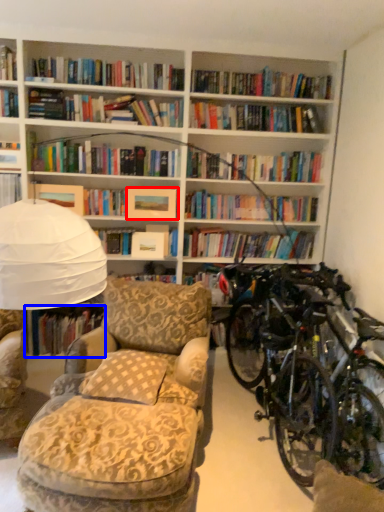
Question: Which of the following is the farthest to the observer, paperback book (highlighted by a red box) or book (highlighted by a blue box)?

Choices:
 (A) paperback book
 (B) book

Answer: (B)